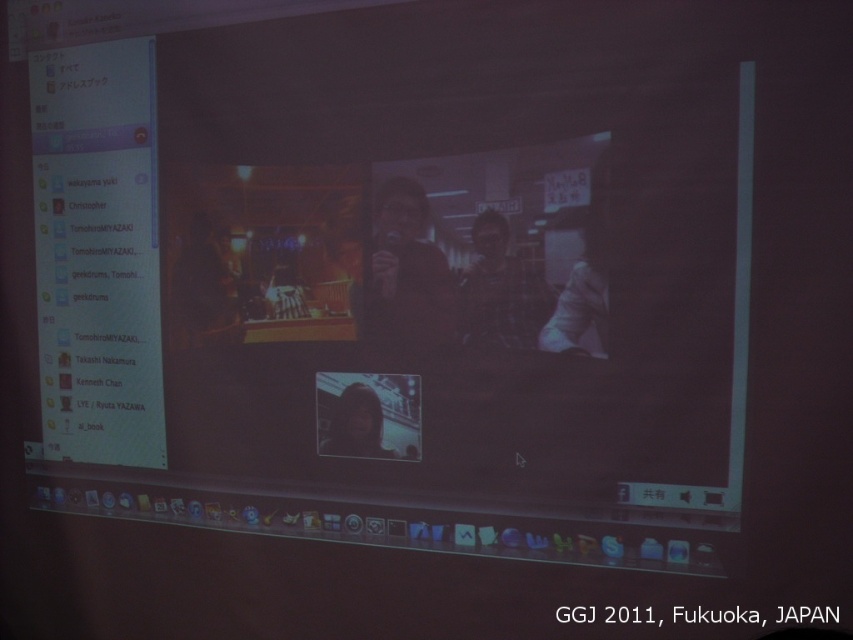
Locate an element on the screen. matte black microphone at center is located at coordinates point(407,273).

Which is above, matte black microphone at center or dark fabric microphone at center?

matte black microphone at center

Which is in front, point (416, 321) or point (196, 308)?

Point (416, 321) is in front.

Locate an element on the screen. matte black microphone at center is located at coordinates (407, 273).

The height and width of the screenshot is (640, 853). What are the coordinates of `plaid shirt at center` in the screenshot? It's located at (500, 291).

What do you see at coordinates (500, 291) in the screenshot? Image resolution: width=853 pixels, height=640 pixels. I see `plaid shirt at center` at bounding box center [500, 291].

Where is `plaid shirt at center`? This screenshot has width=853, height=640. plaid shirt at center is located at coordinates (500, 291).